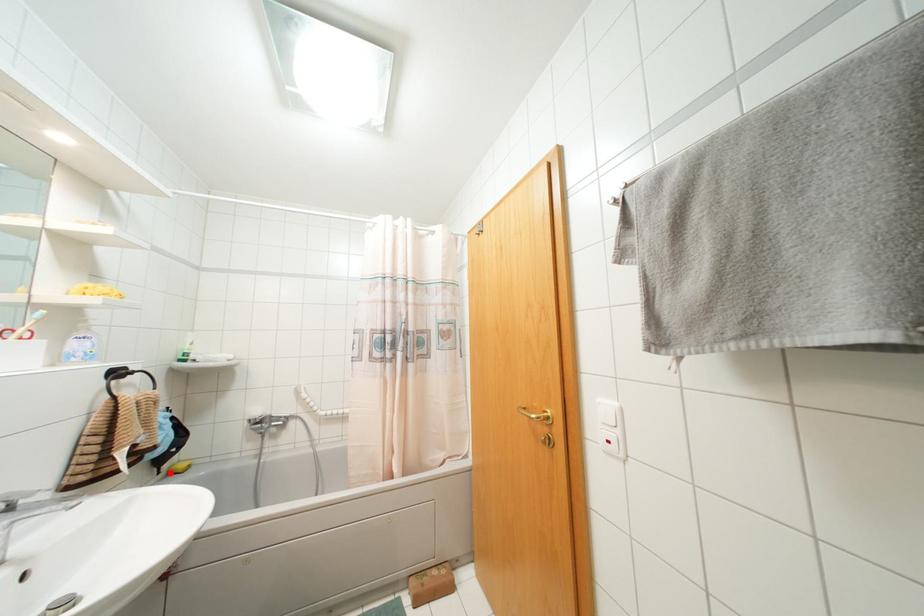
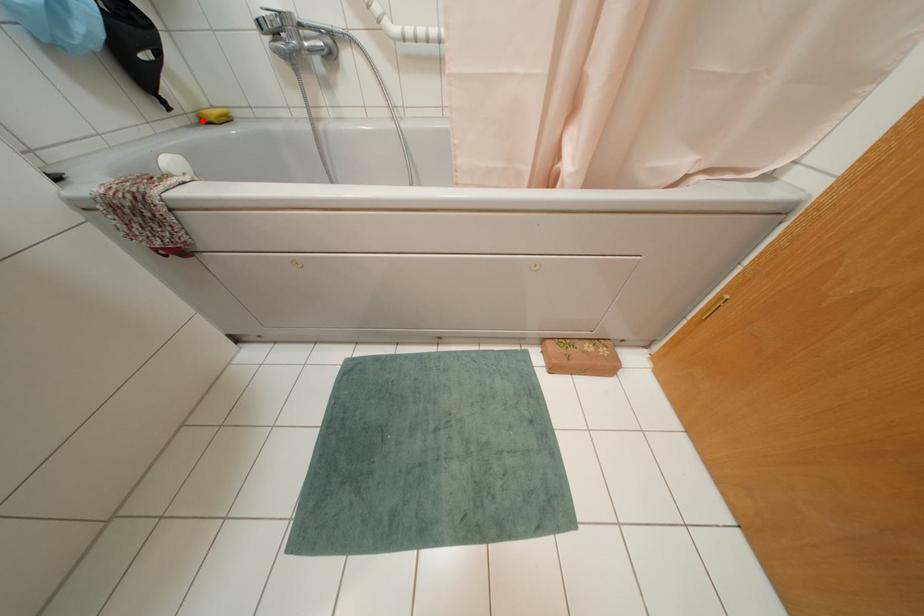
I am providing you with two images of the same scene from different viewpoints. A red point is marked on the first image and another point is marked on the second image. Does the point marked in image1 correspond to the same location as the one in image2?

Yes